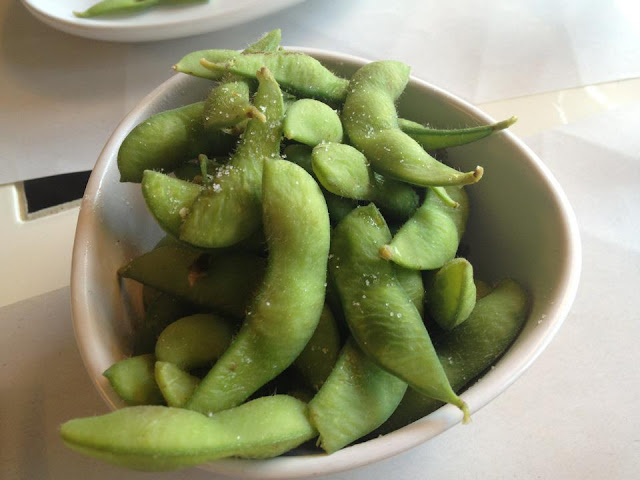
Find the location of a particular element. This screenshot has width=640, height=480. top rim of bowl is located at coordinates (328, 53).